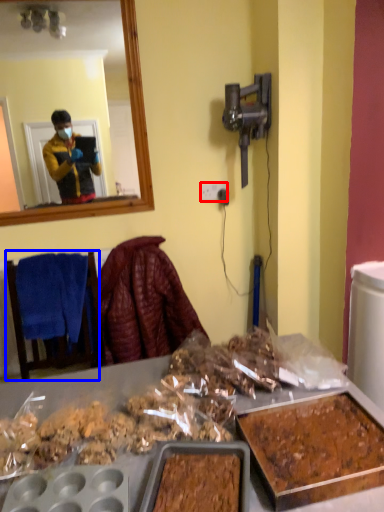
Question: Among these objects, which one is farthest to the camera, power outlet (highlighted by a red box) or furniture (highlighted by a blue box)?

Choices:
 (A) power outlet
 (B) furniture

Answer: (A)